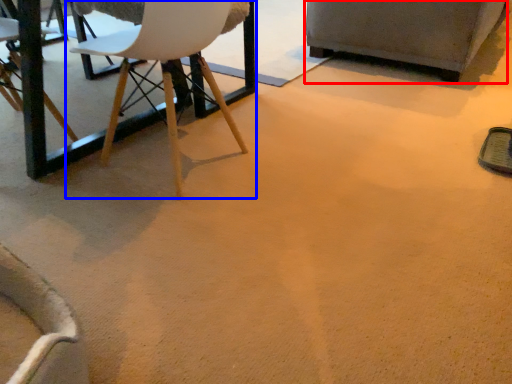
Question: Which point is further to the camera, armchair (highlighted by a red box) or chair (highlighted by a blue box)?

Choices:
 (A) armchair
 (B) chair

Answer: (A)